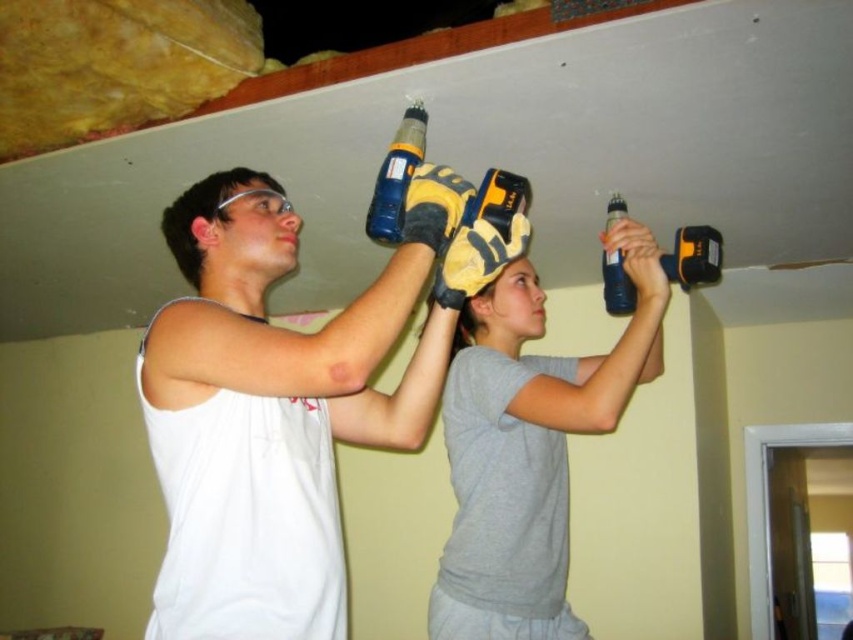
Does blue plastic drill at upper right have a lesser width compared to translucent plastic bottle at upper center?

In fact, blue plastic drill at upper right might be wider than translucent plastic bottle at upper center.

Who is taller, blue plastic drill at upper right or translucent plastic bottle at upper center?

Standing taller between the two is translucent plastic bottle at upper center.

Describe the element at coordinates (693, 257) in the screenshot. I see `blue plastic drill at upper right` at that location.

You are a GUI agent. You are given a task and a screenshot of the screen. Output one action in this format:
    pyautogui.click(x=<x>, y=<y>)
    Task: Click on the blue plastic drill at upper right
    The height and width of the screenshot is (640, 853).
    Given the screenshot: What is the action you would take?
    click(x=693, y=257)

Can you confirm if gray matte shirt at upper center is thinner than translucent plastic bottle at upper center?

In fact, gray matte shirt at upper center might be wider than translucent plastic bottle at upper center.

Does gray matte shirt at upper center have a greater height compared to translucent plastic bottle at upper center?

Correct, gray matte shirt at upper center is much taller as translucent plastic bottle at upper center.

Who is more forward, (628, 228) or (607, 285)?

Point (628, 228) is more forward.

Where is `gray matte shirt at upper center`? The width and height of the screenshot is (853, 640). gray matte shirt at upper center is located at coordinates (527, 448).

Measure the distance between point (611, 300) and camera.

Point (611, 300) is 5.27 feet away from camera.

Based on the photo, is blue plastic drill at upper right to the left of blue plastic drill at upper center from the viewer's perspective?

Incorrect, blue plastic drill at upper right is not on the left side of blue plastic drill at upper center.

Where is `blue plastic drill at upper right`? The height and width of the screenshot is (640, 853). blue plastic drill at upper right is located at coordinates (693, 257).